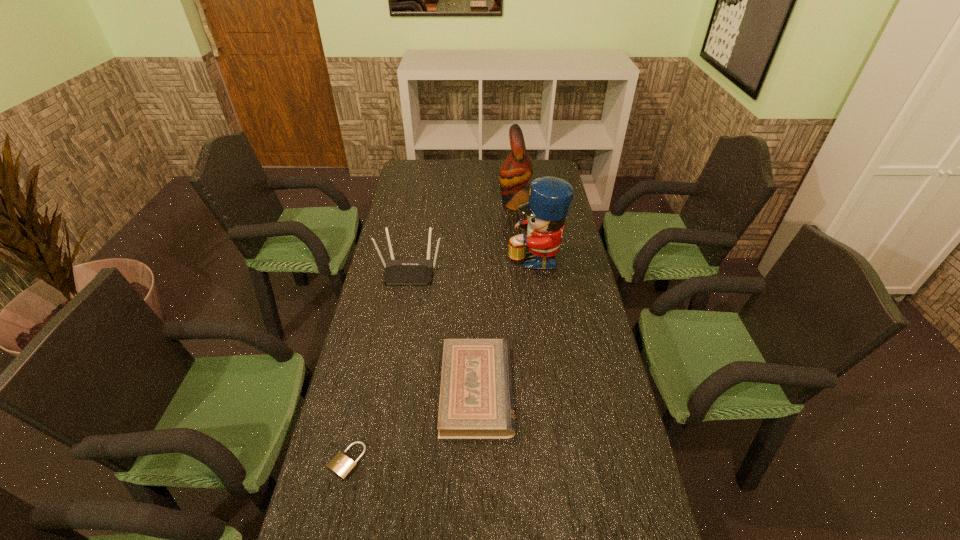
Image resolution: width=960 pixels, height=540 pixels. I want to click on vacant point located on the front-facing side of the nutcracker, so click(456, 258).

You are a GUI agent. You are given a task and a screenshot of the screen. Output one action in this format:
    pyautogui.click(x=<x>, y=<y>)
    Task: Click on the vacant space situated on the front-facing side of the nutcracker
    The image size is (960, 540).
    Given the screenshot: What is the action you would take?
    pyautogui.click(x=491, y=258)

The width and height of the screenshot is (960, 540). I want to click on vacant point located 0.150m on the front-facing side of the nutcracker, so click(467, 258).

This screenshot has height=540, width=960. Identify the location of vacant space located on the front-facing side of the third tallest object. click(390, 382).

Find the location of `free space located on the spine side of the Bible`. free space located on the spine side of the Bible is located at coordinates (611, 390).

The image size is (960, 540). I want to click on vacant point located 0.400m on the back of the nearest object, so click(x=378, y=322).

Where is `router that is positioned at the left edge`? The image size is (960, 540). router that is positioned at the left edge is located at coordinates (396, 271).

Identify the location of padlock present at the left edge. (341, 465).

You are a GUI agent. You are given a task and a screenshot of the screen. Output one action in this format:
    pyautogui.click(x=<x>, y=<y>)
    Task: Click on the parrot present at the right edge
    
    Given the screenshot: What is the action you would take?
    pyautogui.click(x=516, y=170)

Where is `nutcracker located at the right edge`? nutcracker located at the right edge is located at coordinates (550, 198).